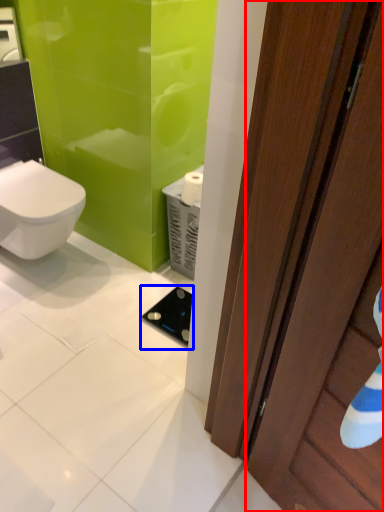
Question: Which of the following is the farthest to the observer, door (highlighted by a red box) or appliance (highlighted by a blue box)?

Choices:
 (A) door
 (B) appliance

Answer: (B)